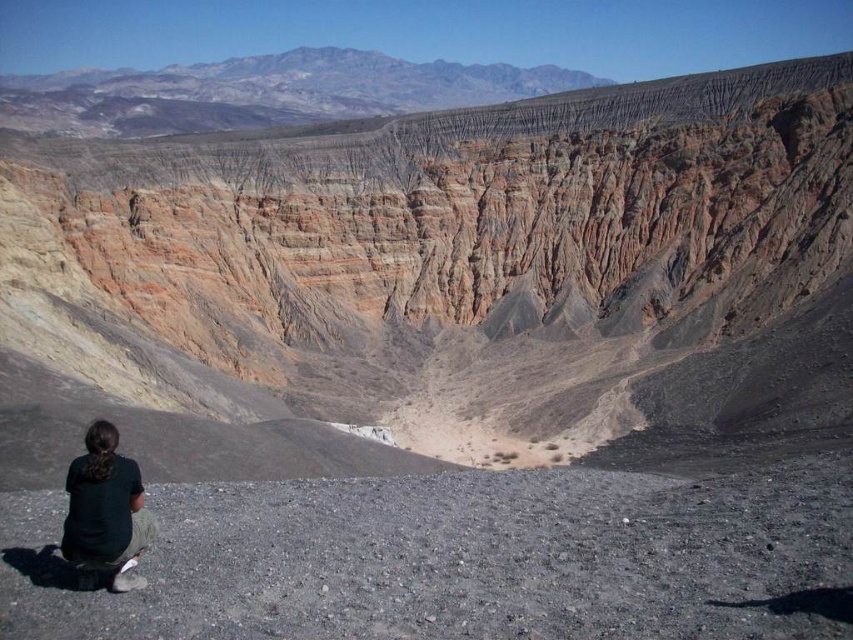
Question: Which point is closer to the camera taking this photo?

Choices:
 (A) pyautogui.click(x=152, y=420)
 (B) pyautogui.click(x=88, y=532)

Answer: (B)

Question: Which object is farther from the camera taking this photo?

Choices:
 (A) dark green shirt at lower left
 (B) rustic rock formation at center

Answer: (B)

Question: Is rustic rock formation at center wider than dark green shirt at lower left?

Choices:
 (A) no
 (B) yes

Answer: (B)

Question: Is rustic rock formation at center to the right of dark green shirt at lower left from the viewer's perspective?

Choices:
 (A) yes
 (B) no

Answer: (A)

Question: Estimate the real-world distances between objects in this image. Which object is farther from the dark green shirt at lower left?

Choices:
 (A) rustic rock formation at center
 (B) rugged rock mountain at upper center

Answer: (B)

Question: Can you confirm if rugged rock mountain at upper center is wider than dark green shirt at lower left?

Choices:
 (A) yes
 (B) no

Answer: (A)